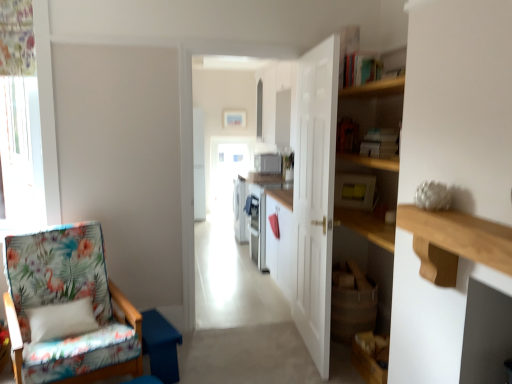
I want to click on free space in front of white wooden door at center, so click(309, 369).